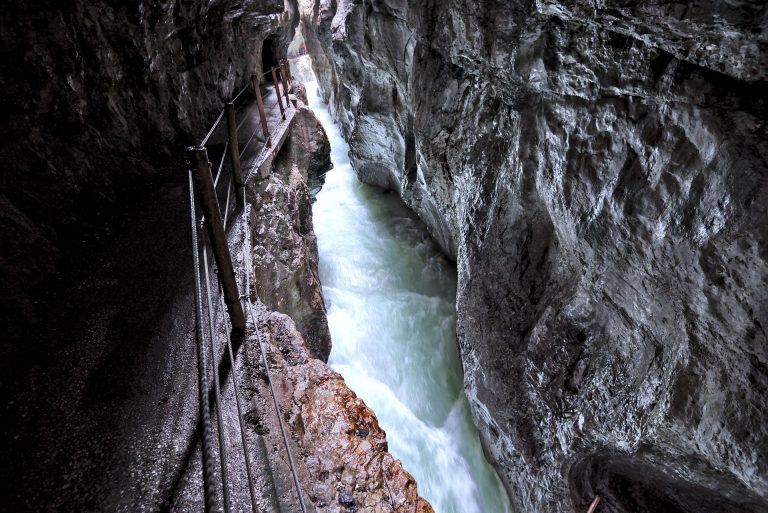
This screenshot has width=768, height=513. I want to click on light, so click(332, 190).